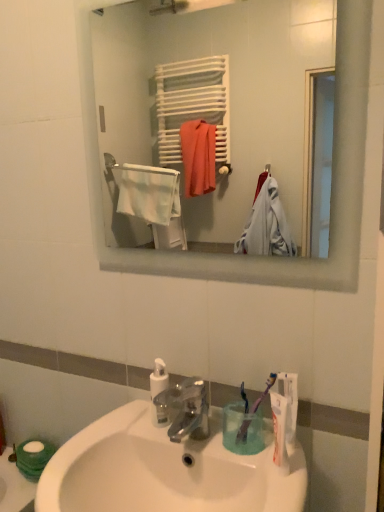
Question: From the image's perspective, is purple plastic toothbrush at lower center, which ranks as the 2th toothbrush in right-to-left order, positioned above or below white glossy sink at lower center?

Choices:
 (A) above
 (B) below

Answer: (A)

Question: Is purple plastic toothbrush at lower center, which ranks as the 2th toothbrush in right-to-left order, in front of or behind white glossy sink at lower center in the image?

Choices:
 (A) front
 (B) behind

Answer: (B)

Question: Which object is the farthest from the white matte toothpaste at lower right?

Choices:
 (A) white matte towel rack at upper center
 (B) white matte toilet paper at lower left
 (C) purple plastic toothbrush at lower center, which is the 1th toothbrush from left to right
 (D) purple plastic toothbrush at lower right, the second toothbrush when ordered from left to right
 (E) satin nickel faucet at center

Answer: (A)

Question: Estimate the real-world distances between objects in this image. Which object is farther from the white glossy sink at lower center?

Choices:
 (A) purple plastic toothbrush at lower center, which is the 1th toothbrush from left to right
 (B) purple plastic toothbrush at lower right, positioned as the first toothbrush in right-to-left order
 (C) white matte towel rack at upper center
 (D) white matte toilet paper at lower left
 (E) white matte toothpaste at lower right

Answer: (C)